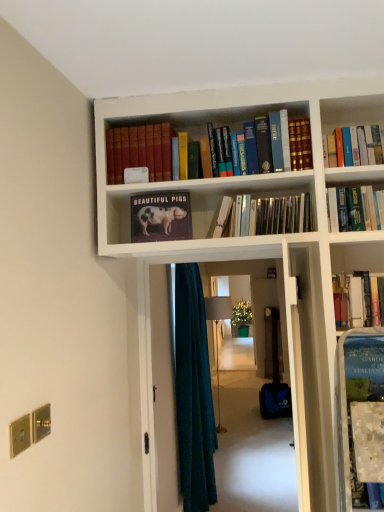
This screenshot has height=512, width=384. What do you see at coordinates (354, 146) in the screenshot? I see `hardcover book at upper right, the 1th book when ordered from right to left` at bounding box center [354, 146].

This screenshot has height=512, width=384. Identify the location of dark teal fabric at center. (193, 393).

The image size is (384, 512). Find the location of `hardcover book at center, placed as the third book when sorted from left to right`. hardcover book at center, placed as the third book when sorted from left to right is located at coordinates (223, 217).

Where is `metallic silver books at center, placed as the 4th book when sorted from left to right`? metallic silver books at center, placed as the 4th book when sorted from left to right is located at coordinates (263, 216).

This screenshot has height=512, width=384. What are the coordinates of `teal fabric screen door at center` in the screenshot? It's located at (163, 392).

Image resolution: width=384 pixels, height=512 pixels. In order to click on hardcover book at upper right, the 1th book when ordered from right to left in this screenshot , I will do `click(354, 146)`.

In terms of size, does wooden door at center appear bigger or smaller than hardcover book at upper right, positioned as the fifth book in left-to-right order?

wooden door at center is bigger than hardcover book at upper right, positioned as the fifth book in left-to-right order.

From the image's perspective, which is above, wooden door at center or hardcover book at upper right, the 1th book when ordered from right to left?

hardcover book at upper right, the 1th book when ordered from right to left, appears higher in the image.

The width and height of the screenshot is (384, 512). What are the coordinates of `the 4th book above the wooden door at center (from a real-world perspective)` in the screenshot? It's located at (354, 146).

Is wooden door at center completely or partially outside of hardcover book at upper right, the 1th book when ordered from right to left?

Indeed, wooden door at center is completely outside hardcover book at upper right, the 1th book when ordered from right to left.

Can you confirm if metallic silver books at center, placed as the 4th book when sorted from left to right, is thinner than matte hardcover book at upper center, which is the 1th book from left to right?

Yes.

From a real-world perspective, is metallic silver books at center, placed as the 4th book when sorted from left to right, located higher than matte hardcover book at upper center, which is counted as the fifth book, starting from the right?

No, from a real-world perspective, metallic silver books at center, placed as the 4th book when sorted from left to right, is not over matte hardcover book at upper center, which is counted as the fifth book, starting from the right

From a real-world perspective, which book is the 3rd one above the metallic silver books at center, placed as the 4th book when sorted from left to right? Please provide its 2D coordinates.

[(140, 151)]

Considering the positions of point (162, 419) and point (191, 400), is point (162, 419) closer or farther from the camera than point (191, 400)?

Clearly, point (162, 419) is closer to the camera than point (191, 400).

Which is correct: teal fabric screen door at center is inside dark teal fabric at center, or outside of it?

teal fabric screen door at center exists outside the volume of dark teal fabric at center.

Find the location of a particular element. The width and height of the screenshot is (384, 512). screen door lying in front of the dark teal fabric at center is located at coordinates (163, 392).

Considering the relative positions of teal fabric screen door at center and dark teal fabric at center in the image provided, is teal fabric screen door at center to the left or to the right of dark teal fabric at center?

teal fabric screen door at center is to the right of dark teal fabric at center.

From a real-world perspective, is hardcover book at center, placed as the third book when sorted from left to right, above or below matte hardcover book at upper center, which is counted as the fifth book, starting from the right?

hardcover book at center, placed as the third book when sorted from left to right, is below matte hardcover book at upper center, which is counted as the fifth book, starting from the right.

Considering the relative positions of hardcover book at center, placed as the third book when sorted from left to right, and matte hardcover book at upper center, which is the 1th book from left to right, in the image provided, is hardcover book at center, placed as the third book when sorted from left to right, to the left of matte hardcover book at upper center, which is the 1th book from left to right, from the viewer's perspective?

In fact, hardcover book at center, placed as the third book when sorted from left to right, is to the right of matte hardcover book at upper center, which is the 1th book from left to right.

Who is smaller, hardcover book at center, marked as the third book in a right-to-left arrangement, or matte hardcover book at upper center, which is the 1th book from left to right?

hardcover book at center, marked as the third book in a right-to-left arrangement.

Is matte hardcover book at upper center, which is the 1th book from left to right, to the left or to the right of wooden door at center in the image?

matte hardcover book at upper center, which is the 1th book from left to right, is positioned on wooden door at center's left side.

From the picture: How different are the orientations of matte hardcover book at upper center, which is counted as the fifth book, starting from the right, and wooden door at center in degrees?

There is a 49.2-degree angle between the facing directions of matte hardcover book at upper center, which is counted as the fifth book, starting from the right, and wooden door at center.

Considering the sizes of objects matte hardcover book at upper center, which is counted as the fifth book, starting from the right, and wooden door at center in the image provided, who is shorter, matte hardcover book at upper center, which is counted as the fifth book, starting from the right, or wooden door at center?

matte hardcover book at upper center, which is counted as the fifth book, starting from the right.

Is matte hardcover book at upper center, which is counted as the fifth book, starting from the right, not within wooden door at center?

Absolutely, matte hardcover book at upper center, which is counted as the fifth book, starting from the right, is external to wooden door at center.

You are a GUI agent. You are given a task and a screenshot of the screen. Output one action in this format:
    pyautogui.click(x=<x>, y=<y>)
    Task: Click on the book that appears below the metallic silver books at center, placed as the 4th book when sorted from left to right (from a real-world perspective)
    The width and height of the screenshot is (384, 512).
    Given the screenshot: What is the action you would take?
    pyautogui.click(x=223, y=217)

From the image's perspective, does hardcover book at center, marked as the third book in a right-to-left arrangement, appear lower than metallic silver books at center, placed as the 4th book when sorted from left to right?

Indeed, from the image's perspective, hardcover book at center, marked as the third book in a right-to-left arrangement, is shown beneath metallic silver books at center, placed as the 4th book when sorted from left to right.

Considering the positions of objects hardcover book at center, placed as the third book when sorted from left to right, and metallic silver books at center, the second book positioned from the right, in the image provided, who is more to the left, hardcover book at center, placed as the third book when sorted from left to right, or metallic silver books at center, the second book positioned from the right,?

hardcover book at center, placed as the third book when sorted from left to right, is more to the left.

From a real-world perspective, is hardcover book at center, marked as the third book in a right-to-left arrangement, positioned over metallic silver books at center, placed as the 4th book when sorted from left to right, based on gravity?

No, from a real-world perspective, hardcover book at center, marked as the third book in a right-to-left arrangement, is not above metallic silver books at center, placed as the 4th book when sorted from left to right.

Based on the photo, is hardcover book at upper right, the 1th book when ordered from right to left, at the back of matte paper book at center, which appears as the second book when viewed from the left?

No, matte paper book at center, which appears as the second book when viewed from the left,'s orientation is not away from hardcover book at upper right, the 1th book when ordered from right to left.

Considering the sizes of matte paper book at center, which appears as the second book when viewed from the left, and hardcover book at upper right, the 1th book when ordered from right to left, in the image, is matte paper book at center, which appears as the second book when viewed from the left, taller or shorter than hardcover book at upper right, the 1th book when ordered from right to left,?

Clearly, matte paper book at center, which appears as the second book when viewed from the left, is taller compared to hardcover book at upper right, the 1th book when ordered from right to left.

Which is nearer, (176, 232) or (381, 147)?

The point (381, 147) is closer to the camera.

From a real-world perspective, which book is the 1st one above the matte paper book at center, which appears as the fourth book when viewed from the right? Please provide its 2D coordinates.

[(354, 146)]

Find the location of `book that is the 1st object to the left of the wooden door at center, starting at the anchor`. book that is the 1st object to the left of the wooden door at center, starting at the anchor is located at coordinates (354, 146).

At what (x,y) coordinates should I click in order to perform the action: click on the 1st book above when counting from the metallic silver books at center, placed as the 4th book when sorted from left to right (from the image's perspective). Please return your answer as a coordinate pair (x, y). This screenshot has width=384, height=512. Looking at the image, I should click on (140, 151).

Consider the image. Looking at the image, which one is located further to wooden door at center, teal fabric screen door at center or matte hardcover book at upper center, which is counted as the fifth book, starting from the right?

Based on the image, matte hardcover book at upper center, which is counted as the fifth book, starting from the right, appears to be further to wooden door at center.

From the image, which object appears to be nearer to wooden door at center, hardcover book at upper right, positioned as the fifth book in left-to-right order, or matte paper book at center, which appears as the fourth book when viewed from the right?

The object closer to wooden door at center is hardcover book at upper right, positioned as the fifth book in left-to-right order.

Considering their positions, is matte hardcover book at upper center, which is the 1th book from left to right, positioned further to wooden door at center than hardcover book at upper right, positioned as the fifth book in left-to-right order?

The object further to wooden door at center is matte hardcover book at upper center, which is the 1th book from left to right.

Looking at the image, which one is located further to dark teal fabric at center, wooden door at center or hardcover book at center, marked as the third book in a right-to-left arrangement?

Based on the image, wooden door at center appears to be further to dark teal fabric at center.

Estimate the real-world distances between objects in this image. Which object is closer to teal fabric screen door at center, matte paper book at center, which appears as the second book when viewed from the left, or hardcover book at center, placed as the third book when sorted from left to right?

The object closer to teal fabric screen door at center is matte paper book at center, which appears as the second book when viewed from the left.

Estimate the real-world distances between objects in this image. Which object is further from metallic silver books at center, the second book positioned from the right, hardcover book at center, marked as the third book in a right-to-left arrangement, or matte paper book at center, which appears as the fourth book when viewed from the right?

The object further to metallic silver books at center, the second book positioned from the right, is matte paper book at center, which appears as the fourth book when viewed from the right.

When comparing their distances from hardcover book at center, marked as the third book in a right-to-left arrangement, does metallic silver books at center, placed as the 4th book when sorted from left to right, or dark teal fabric at center seem closer?

Based on the image, metallic silver books at center, placed as the 4th book when sorted from left to right, appears to be nearer to hardcover book at center, marked as the third book in a right-to-left arrangement.

When comparing their distances from teal fabric screen door at center, does matte hardcover book at upper center, which is counted as the fifth book, starting from the right, or hardcover book at center, marked as the third book in a right-to-left arrangement, seem further?

hardcover book at center, marked as the third book in a right-to-left arrangement.

Locate an element on the screen. screen door between matte hardcover book at upper center, which is counted as the fifth book, starting from the right, and dark teal fabric at center in the up-down direction is located at coordinates 163,392.

Locate an element on the screen. The height and width of the screenshot is (512, 384). screen door between matte paper book at center, which appears as the fourth book when viewed from the right, and wooden door at center in the front-back direction is located at coordinates (163, 392).

Where is `curtain between matte hardcover book at upper center, which is counted as the fifth book, starting from the right, and wooden door at center in the front-back direction`? curtain between matte hardcover book at upper center, which is counted as the fifth book, starting from the right, and wooden door at center in the front-back direction is located at coordinates (193, 393).

Where is `curtain between hardcover book at upper right, the 1th book when ordered from right to left, and wooden door at center, along the z-axis`? The width and height of the screenshot is (384, 512). curtain between hardcover book at upper right, the 1th book when ordered from right to left, and wooden door at center, along the z-axis is located at coordinates (193, 393).